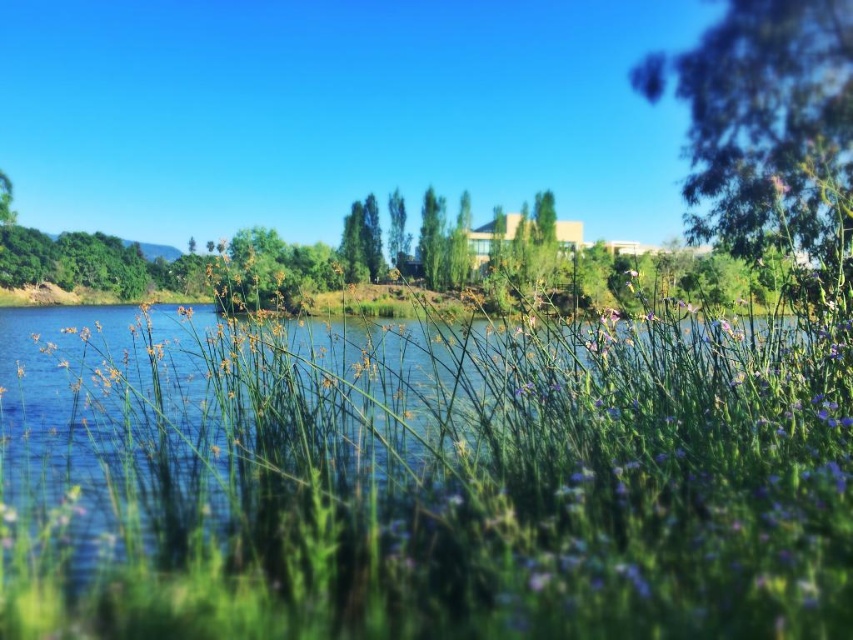
Question: Which object appears closest to the camera in this image?

Choices:
 (A) green leafy tree at center
 (B) green leafy tree at upper right

Answer: (B)

Question: Can you confirm if green grass at center is positioned above green leafy tree at upper right?

Choices:
 (A) yes
 (B) no

Answer: (B)

Question: Among these points, which one is nearest to the camera?

Choices:
 (A) (833, 77)
 (B) (527, 611)
 (C) (392, 228)

Answer: (B)

Question: Is green leafy tree at upper right below green leafy tree at center?

Choices:
 (A) yes
 (B) no

Answer: (B)

Question: Is green leafy tree at upper right smaller than green leafy tree at center?

Choices:
 (A) yes
 (B) no

Answer: (B)

Question: Which object appears farthest from the camera in this image?

Choices:
 (A) green leafy tree at upper right
 (B) green leafy tree at center

Answer: (B)